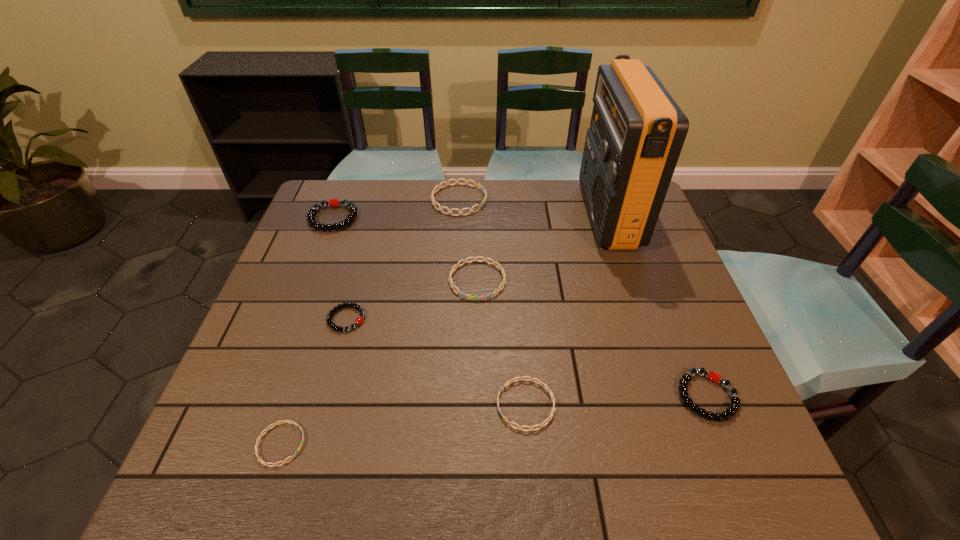
Where is `empty location between the radio receiver and the rightmost bracelet`? The image size is (960, 540). empty location between the radio receiver and the rightmost bracelet is located at coordinates (658, 306).

Identify the location of vacant region between the biggest black bracelet and the rightmost bracelet. (520, 307).

At what (x,y) coordinates should I click in order to perform the action: click on empty space that is in between the biggest blue bracelet and the third biggest blue bracelet. Please return your answer as a coordinate pair (x, y). This screenshot has width=960, height=540. Looking at the image, I should click on (492, 302).

Identify the location of vacant point located between the biggest blue bracelet and the fourth nearest bracelet. This screenshot has height=540, width=960. (403, 259).

This screenshot has height=540, width=960. In order to click on vacant area that lies between the biggest black bracelet and the second biggest blue bracelet in this screenshot , I will do `click(405, 249)`.

The height and width of the screenshot is (540, 960). Identify the location of vacant space that is in between the shortest object and the second smallest blue bracelet. (x=403, y=424).

The height and width of the screenshot is (540, 960). What are the coordinates of `object that stands as the sixth closest to the radio receiver` in the screenshot? It's located at (335, 202).

In order to click on object that ranks as the third closest to the rightmost bracelet in this screenshot , I will do `click(452, 271)`.

Select which bracelet appears as the fourth closest to the tallest object. Please provide its 2D coordinates. Your answer should be formatted as a tuple, i.e. [(x, y)], where the tuple contains the x and y coordinates of a point satisfying the conditions above.

[(509, 382)]

Identify which bracelet is the closest to the shortest object. Please provide its 2D coordinates. Your answer should be formatted as a tuple, i.e. [(x, y)], where the tuple contains the x and y coordinates of a point satisfying the conditions above.

[(359, 320)]